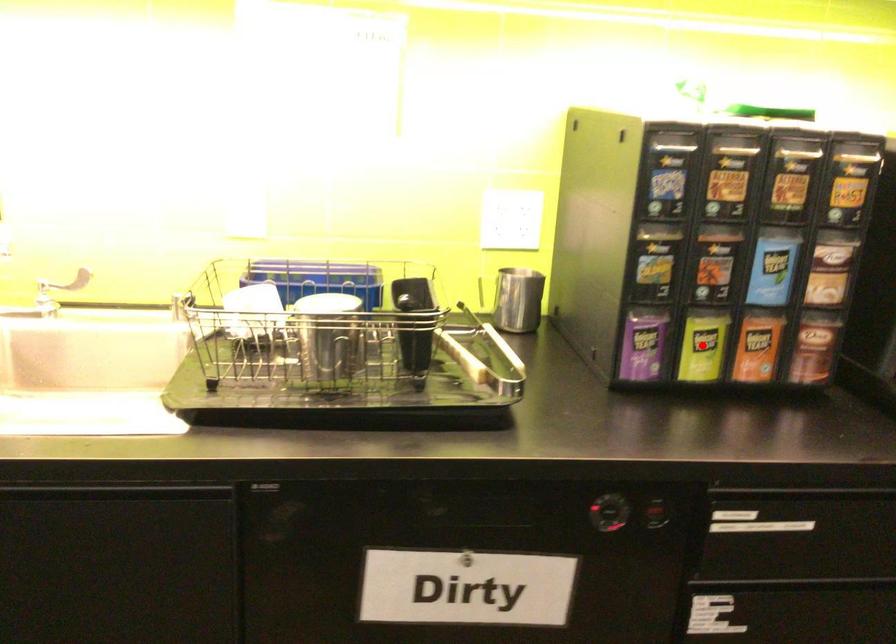
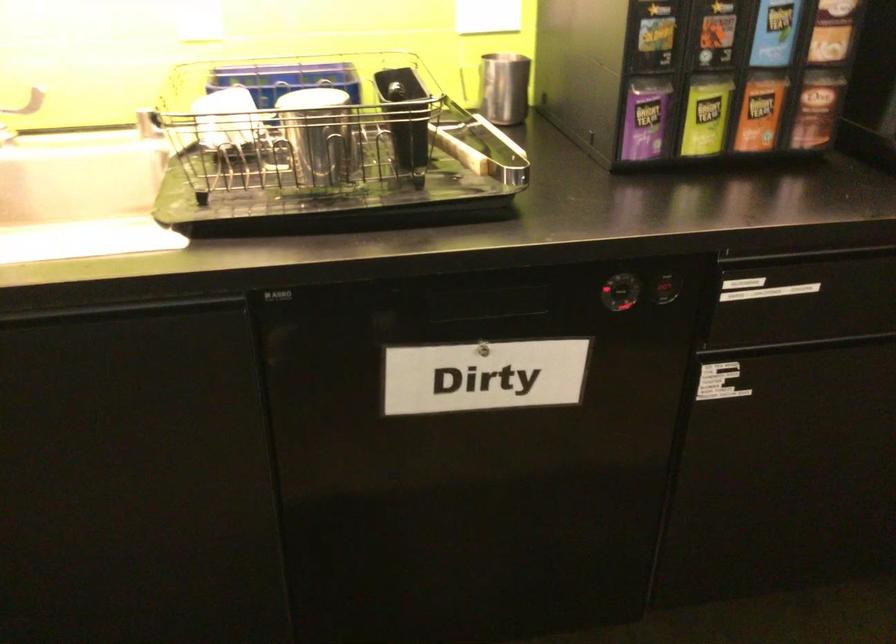
Locate, in the second image, the point that corresponds to the highlighted location in the first image.

(705, 116)